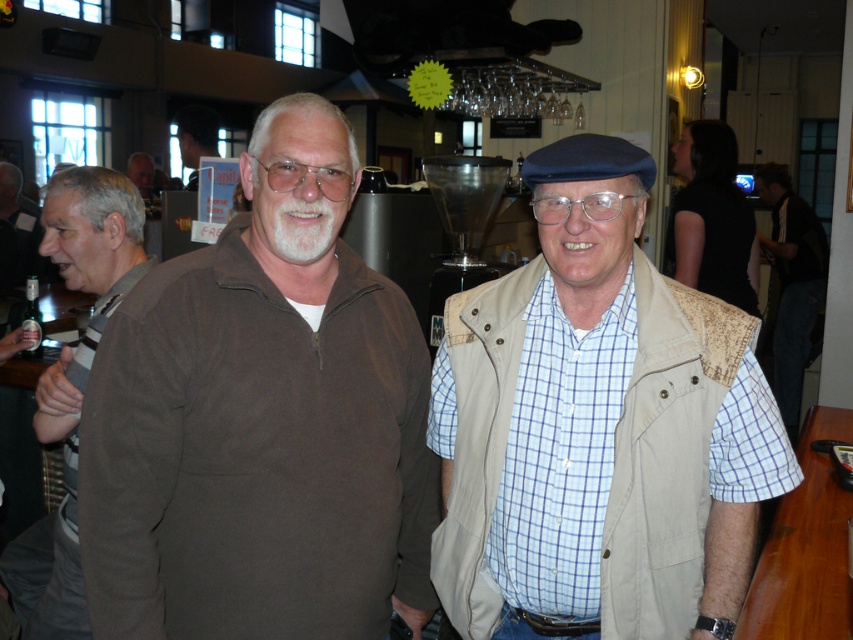
You are a tailor measuring clothing items in a store. You have a beige textured vest at center and a matte black jacket at upper left. Which clothing item is wider?

The beige textured vest at center is wider than the matte black jacket at upper left according to the description.

You are standing in the image and want to hand a coffee cup to the person wearing the brown suede sweater at center. Based on their position, which direction should you approach from?

The brown suede sweater at center is located at point (262, 420), so you should approach from the center direction to hand them the coffee cup.